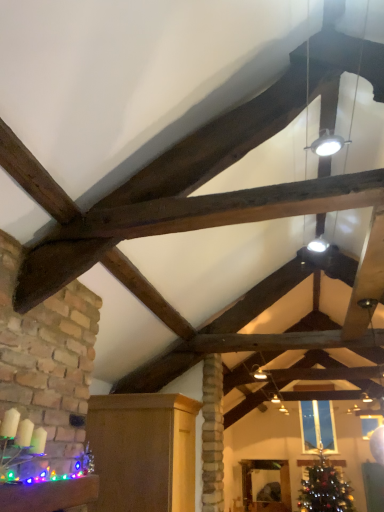
Question: Is wooden mirror at center, positioned as the third furniture in front-to-back order, shorter than multicolored plastic garland at lower left, which is the third furniture from back to front?

Choices:
 (A) no
 (B) yes

Answer: (A)

Question: Is wooden mirror at center, the 1th furniture positioned from the back, wider than multicolored plastic garland at lower left, arranged as the first furniture when viewed from the top?

Choices:
 (A) yes
 (B) no

Answer: (B)

Question: Is wooden mirror at center, which appears as the 1th furniture when viewed from the right, bigger than multicolored plastic garland at lower left, acting as the 1th furniture starting from the left?

Choices:
 (A) no
 (B) yes

Answer: (A)

Question: Is wooden mirror at center, acting as the first furniture starting from the bottom, at the right side of multicolored plastic garland at lower left, arranged as the first furniture when viewed from the front?

Choices:
 (A) yes
 (B) no

Answer: (A)

Question: From a real-world perspective, does wooden mirror at center, acting as the first furniture starting from the bottom, stand above multicolored plastic garland at lower left, arranged as the first furniture when viewed from the top?

Choices:
 (A) no
 (B) yes

Answer: (A)

Question: Does wooden mirror at center, which appears as the 1th furniture when viewed from the right, turn towards multicolored plastic garland at lower left, which is counted as the 3th furniture, starting from the bottom?

Choices:
 (A) no
 (B) yes

Answer: (B)

Question: Does shiny green christmas tree at lower right have a smaller size compared to clear glass window at center?

Choices:
 (A) no
 (B) yes

Answer: (A)

Question: Could you tell me if shiny green christmas tree at lower right is facing clear glass window at center?

Choices:
 (A) no
 (B) yes

Answer: (A)

Question: Does shiny green christmas tree at lower right have a larger size compared to clear glass window at center?

Choices:
 (A) yes
 (B) no

Answer: (A)

Question: Is shiny green christmas tree at lower right closer to camera compared to clear glass window at center?

Choices:
 (A) yes
 (B) no

Answer: (A)

Question: From the image's perspective, is shiny green christmas tree at lower right beneath clear glass window at center?

Choices:
 (A) no
 (B) yes

Answer: (B)

Question: Considering the relative positions of shiny green christmas tree at lower right and clear glass window at center in the image provided, is shiny green christmas tree at lower right to the left of clear glass window at center from the viewer's perspective?

Choices:
 (A) no
 (B) yes

Answer: (B)

Question: Can we say clear glass window at center lies outside matte wood cabinet at lower left, arranged as the second furniture when viewed from the back?

Choices:
 (A) yes
 (B) no

Answer: (A)